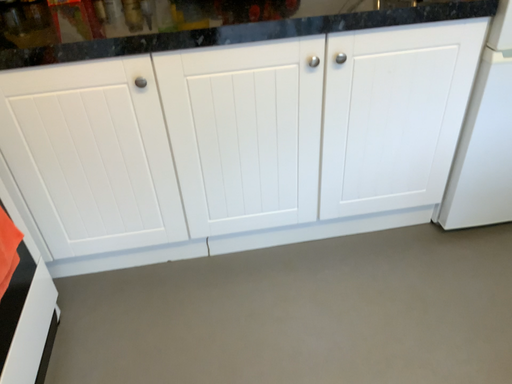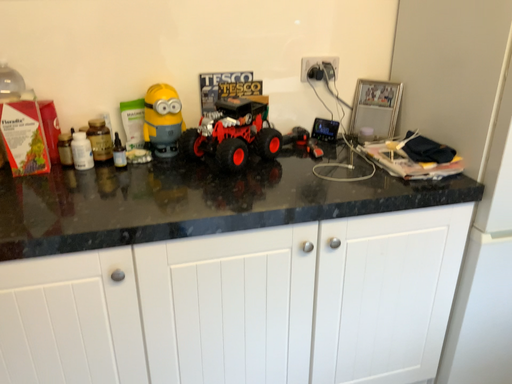
Question: How did the camera likely rotate when shooting the video?

Choices:
 (A) rotated upward
 (B) rotated downward

Answer: (A)